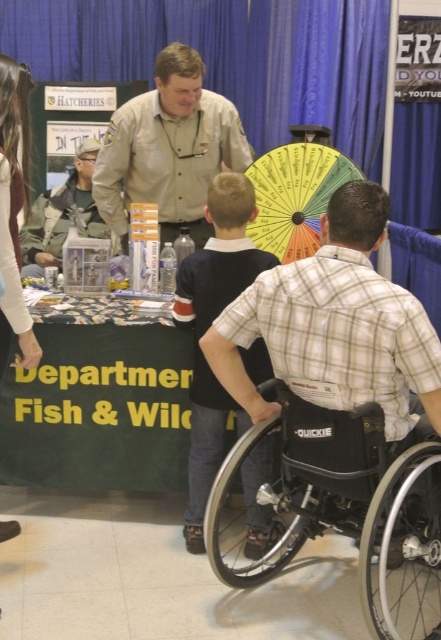
You are standing at the Fish and Wildlife event table and want to know which of the two points, point (257, 221) or point (44, 243), is closer to you. Can you determine this based on their positions?

Point (257, 221) is closer to the viewer than point (44, 243).

You are a participant at the Fish and Wildlife event and you want to reach the yellow fabric umbrella at center. The spinning wheel is in your path. Can you go around the spinning wheel to reach the umbrella?

The yellow fabric umbrella at center is located at point (295, 195), so yes, you can go around the spinning wheel to reach it as long as there is enough space to maneuver around the spinning wheel.